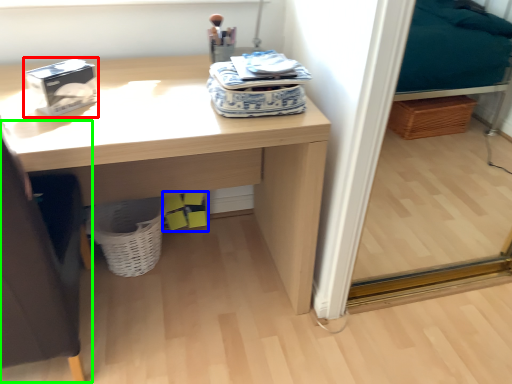
Question: Estimate the real-world distances between objects in this image. Which object is closer to box (highlighted by a red box), box (highlighted by a blue box) or swivel chair (highlighted by a green box)?

Choices:
 (A) box
 (B) swivel chair

Answer: (B)